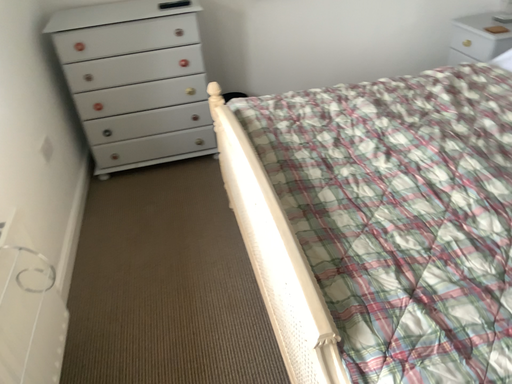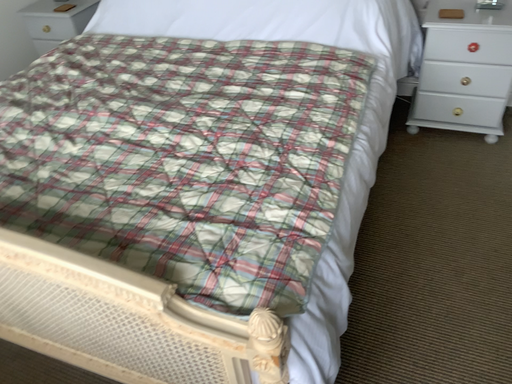
Question: How did the camera likely rotate when shooting the video?

Choices:
 (A) rotated downward
 (B) rotated upward

Answer: (B)